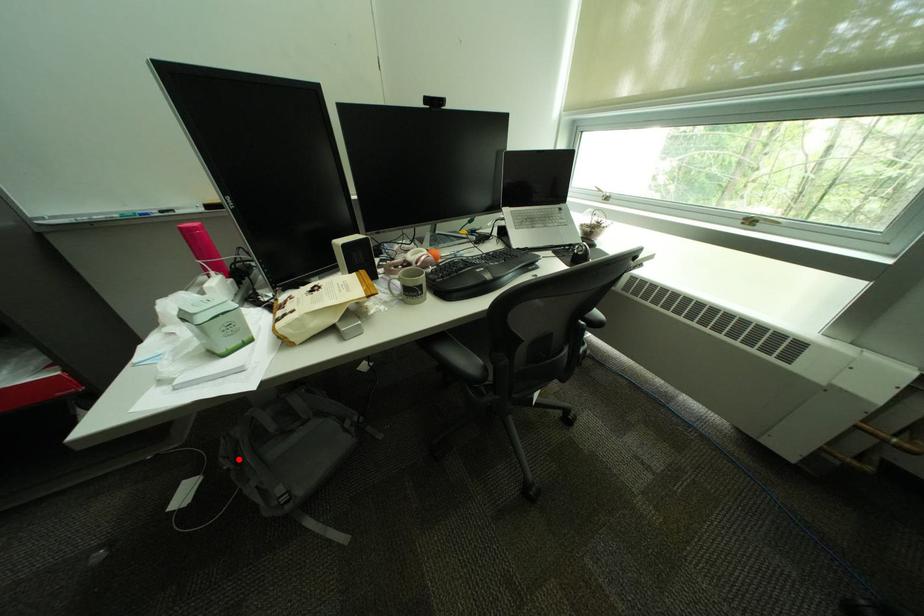
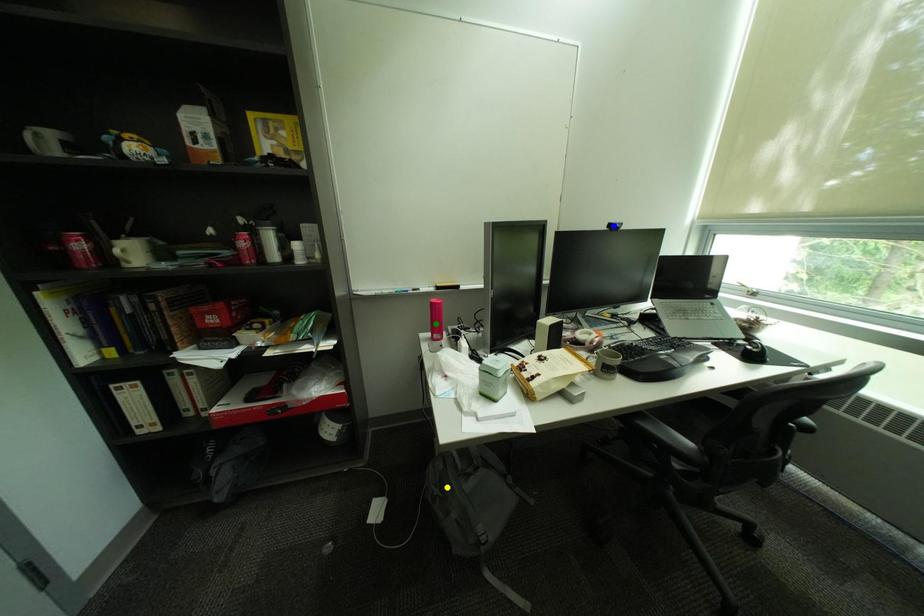
Question: I am providing you with two images of the same scene from different viewpoints. A red point is marked on the first image. You are given multiple points on the second image. Which point in image 2 is actually the same real-world point as the red point in image 1?

Choices:
 (A) blue point
 (B) yellow point
 (C) green point

Answer: (B)